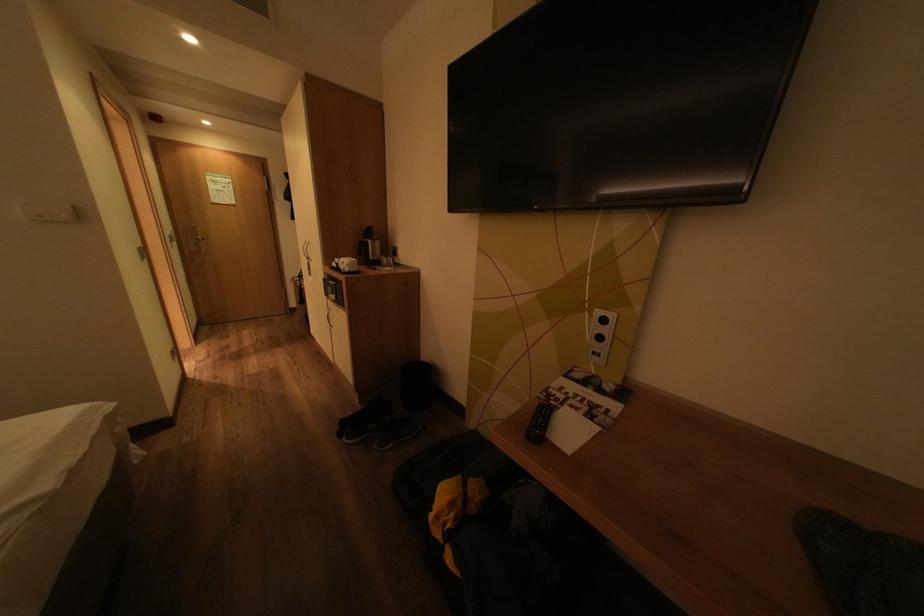
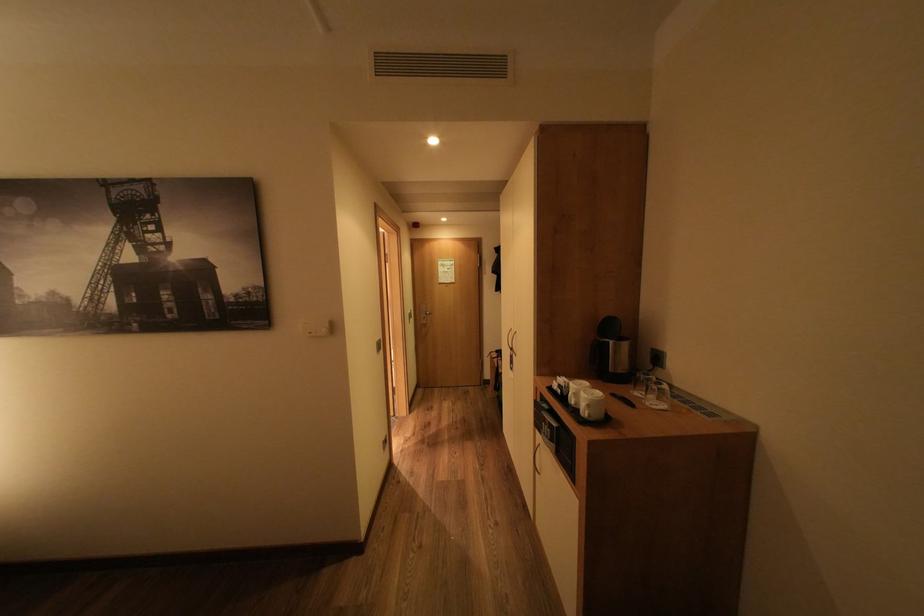
Find the pixel in the second image that matches (379,269) in the first image.

(624, 395)